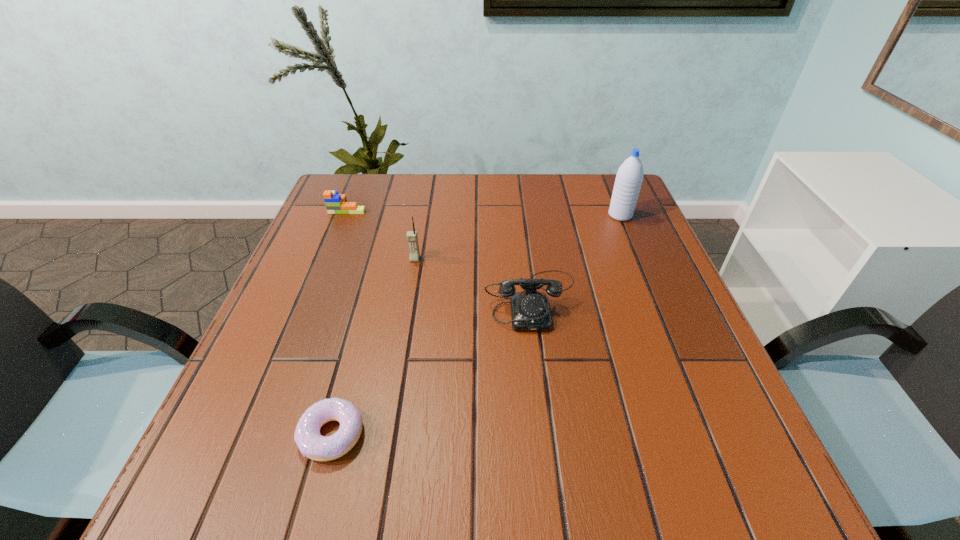
Locate an element on the screen. vacant space that's between the rightmost object and the second nearest object is located at coordinates (576, 258).

This screenshot has width=960, height=540. Find the location of `free space between the third farthest object and the leftmost object`. free space between the third farthest object and the leftmost object is located at coordinates (381, 233).

Where is `vacant area that lies between the Lego and the nearest object`? vacant area that lies between the Lego and the nearest object is located at coordinates (340, 321).

Find the location of a particular element. The image size is (960, 540). free point between the second object from right to left and the fourth shortest object is located at coordinates (473, 279).

Identify the location of vacant point located between the rightmost object and the leftmost object. (484, 212).

The image size is (960, 540). I want to click on unoccupied area between the third shortest object and the shortest object, so click(x=431, y=367).

Identify the location of vacant space that is in between the third nearest object and the water bottle. (517, 237).

Identify the location of blank region between the Lego and the second object from left to right. (340, 321).

Locate an element on the screen. The image size is (960, 540). vacant region between the telephone and the rightmost object is located at coordinates click(x=576, y=258).

Locate an element on the screen. vacant area that lies between the water bottle and the doughnut is located at coordinates (476, 325).